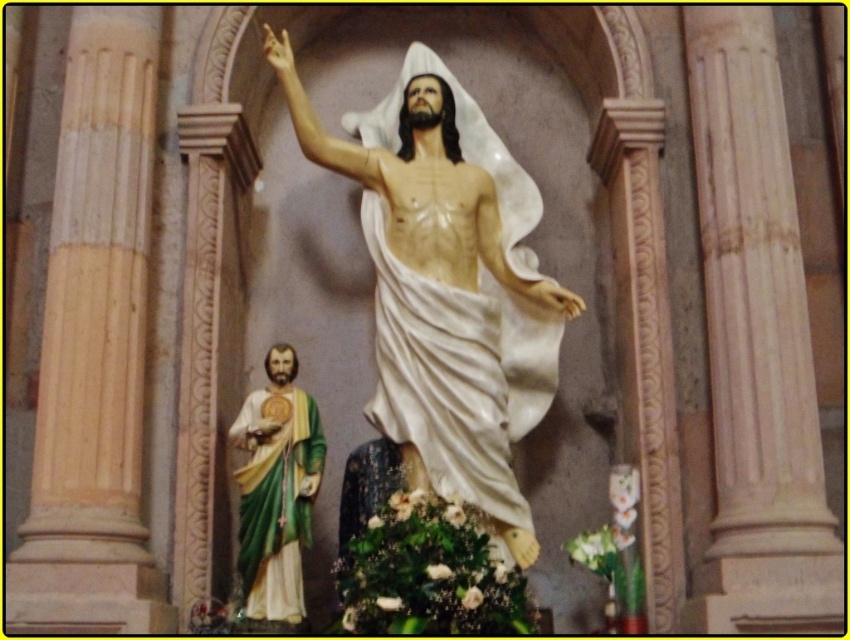
Question: Can you confirm if white marble statue at center is positioned above green painted wood statue at left?

Choices:
 (A) no
 (B) yes

Answer: (B)

Question: Among these points, which one is farthest from the camera?

Choices:
 (A) (547, 380)
 (B) (304, 520)

Answer: (A)

Question: Can you confirm if white marble statue at center is smaller than green painted wood statue at left?

Choices:
 (A) yes
 (B) no

Answer: (B)

Question: Is white marble statue at center above green painted wood statue at left?

Choices:
 (A) yes
 (B) no

Answer: (A)

Question: Which point appears farthest from the camera in this image?

Choices:
 (A) (450, 488)
 (B) (251, 464)

Answer: (B)